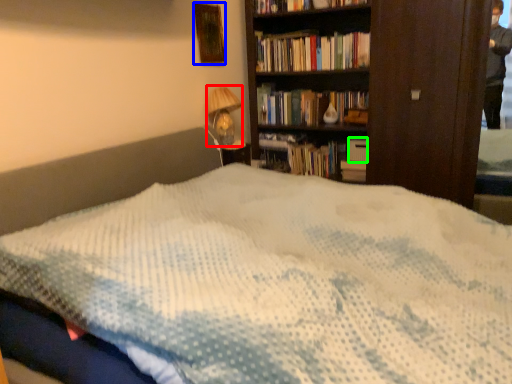
Question: Which object is the closest to the table lamp (highlighted by a red box)? Choose among these: picture frame (highlighted by a blue box) or paperback book (highlighted by a green box).

Choices:
 (A) picture frame
 (B) paperback book

Answer: (A)